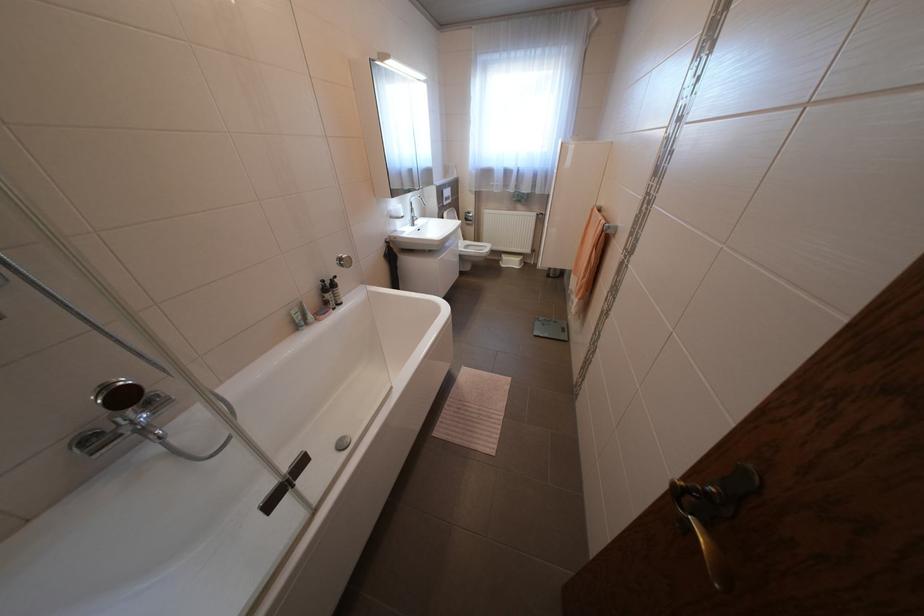
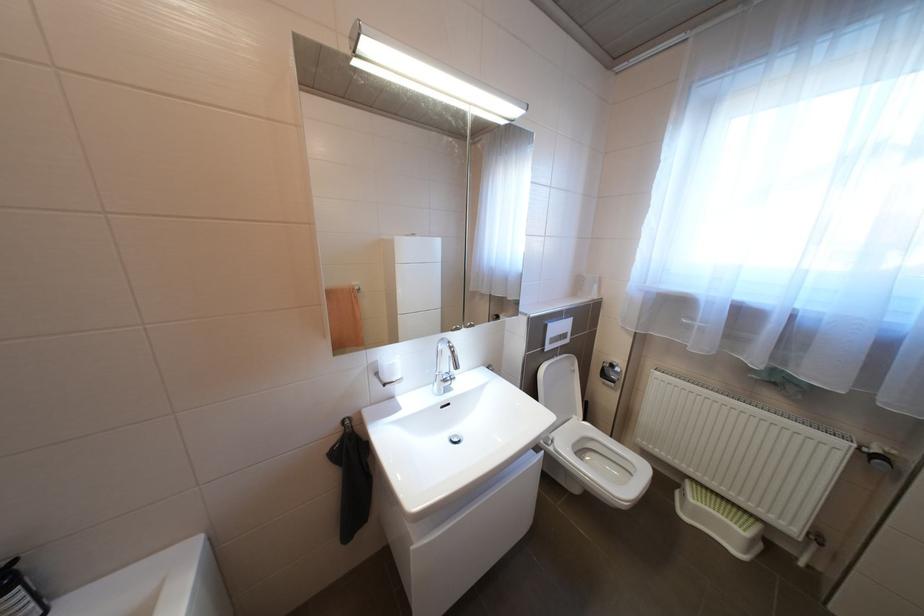
Where in the second image is the point corresponding to pixel 451 190 from the first image?

(548, 325)